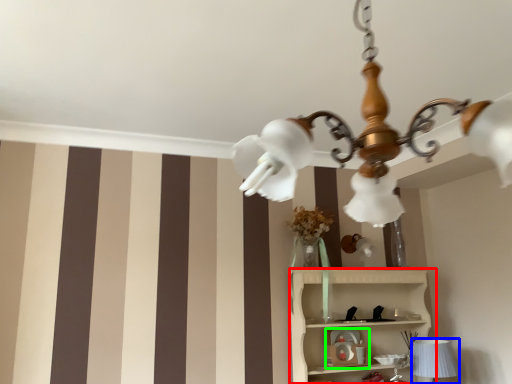
Question: Estimate the real-world distances between objects in this image. Which object is farther from shelf (highlighted by a red box), table lamp (highlighted by a blue box) or toy (highlighted by a green box)?

Choices:
 (A) table lamp
 (B) toy

Answer: (A)